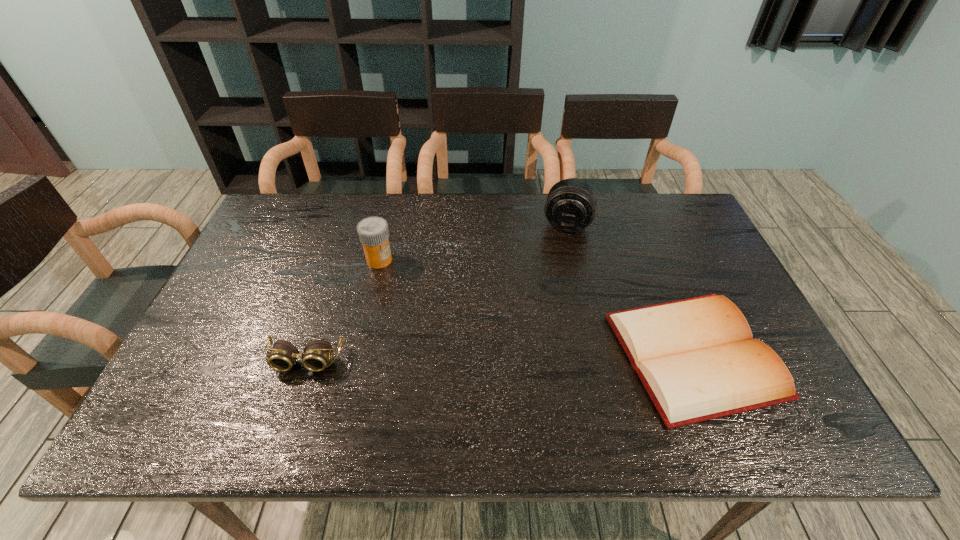
Where is `vacant spot on the desktop that is between the second shortest object and the Bible and is positioned on the label side of the medicine`? vacant spot on the desktop that is between the second shortest object and the Bible and is positioned on the label side of the medicine is located at coordinates (447, 359).

The image size is (960, 540). What are the coordinates of `free spot on the desktop that is between the goggles and the shortest object and is positioned on the front-facing side of the telephoto lens` in the screenshot? It's located at (539, 357).